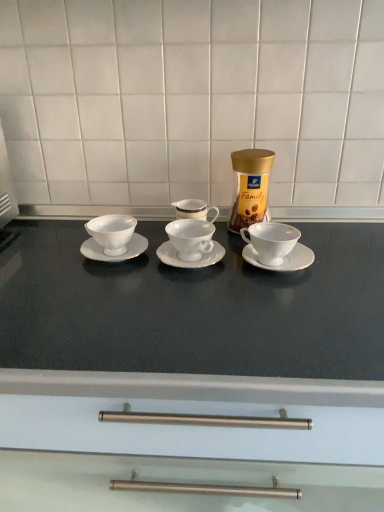
Identify the location of vacant area that is in front of white ceramic saucer at right, marked as the 3th saucer in a left-to-right arrangement. This screenshot has height=512, width=384. (291, 306).